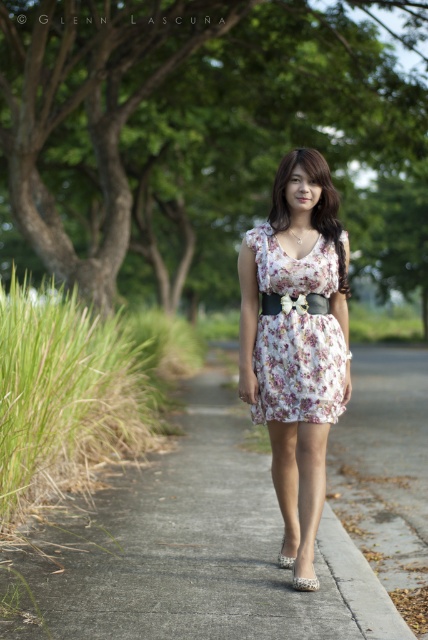
Is floral fabric dress at center to the left of floral cotton dress at center from the viewer's perspective?

No, floral fabric dress at center is not to the left of floral cotton dress at center.

Is floral fabric dress at center positioned before floral cotton dress at center?

Yes, it is in front of floral cotton dress at center.

Where is `floral fabric dress at center`? Image resolution: width=428 pixels, height=640 pixels. floral fabric dress at center is located at coordinates (296, 339).

Where is `floral fabric dress at center`? This screenshot has width=428, height=640. floral fabric dress at center is located at coordinates (296, 339).

Is the position of gray concrete pavement at center more distant than that of floral fabric dress at center?

No, gray concrete pavement at center is in front of floral fabric dress at center.

Is gray concrete pavement at center positioned before floral fabric dress at center?

Yes, it is.

Who is more forward, (107, 496) or (279, 368)?

Positioned in front is point (279, 368).

I want to click on gray concrete pavement at center, so click(246, 525).

Does floral fabric dress at center have a greater width compared to pearl-like fabric sandal at lower center?

Indeed, floral fabric dress at center has a greater width compared to pearl-like fabric sandal at lower center.

The height and width of the screenshot is (640, 428). Describe the element at coordinates (296, 339) in the screenshot. I see `floral fabric dress at center` at that location.

Describe the element at coordinates (296, 339) in the screenshot. I see `floral fabric dress at center` at that location.

The image size is (428, 640). I want to click on floral fabric dress at center, so click(296, 339).